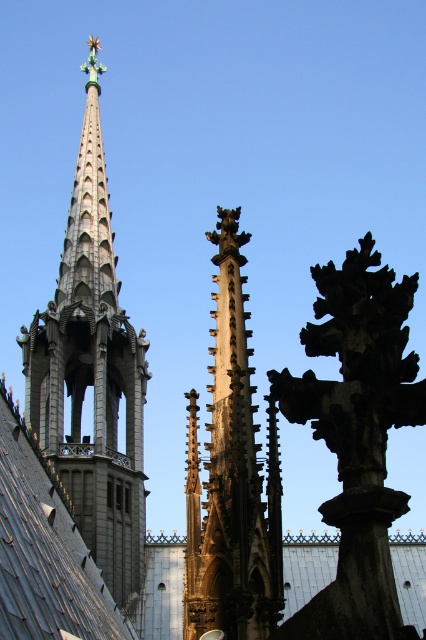
Question: Which point is farther to the camera?

Choices:
 (A) (256, 522)
 (B) (65, 500)
 (C) (108, 280)

Answer: (C)

Question: Does gray stone spire at upper left come in front of brown stone spire at center?

Choices:
 (A) no
 (B) yes

Answer: (A)

Question: In this image, where is gray stone spire at upper left located relative to brown stone spire at center?

Choices:
 (A) below
 (B) above

Answer: (B)

Question: Can you confirm if gray stone spire at upper left is smaller than brown stone spire at center?

Choices:
 (A) yes
 (B) no

Answer: (B)

Question: Estimate the real-world distances between objects in this image. Which object is closer to the gray slate roof at center?

Choices:
 (A) gray stone spire at upper left
 (B) brown stone spire at center

Answer: (B)

Question: Which point is farther from the camera taking this photo?

Choices:
 (A) (124, 609)
 (B) (14, 534)

Answer: (A)